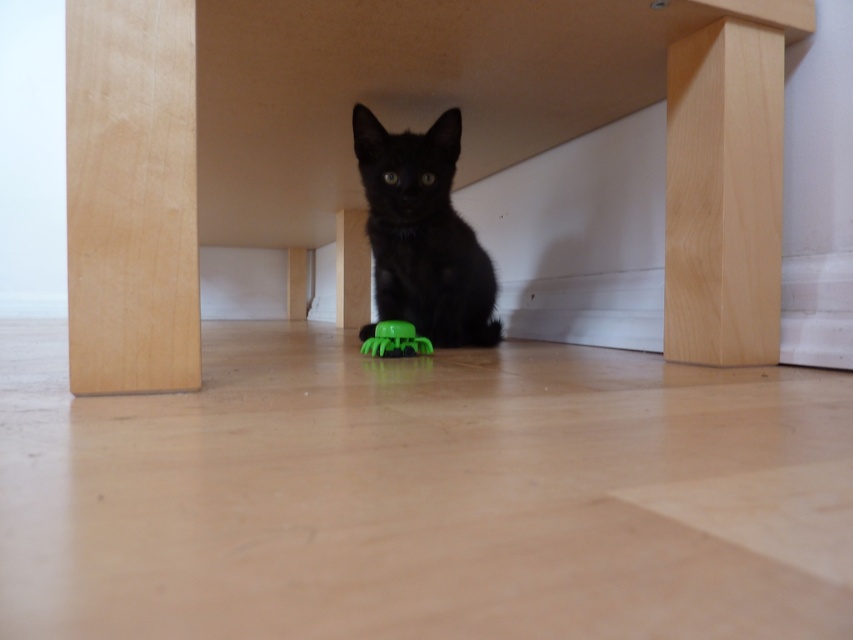
Can you confirm if black matte cat at center is taller than green rubber toy at center?

Yes, black matte cat at center is taller than green rubber toy at center.

Who is more distant from viewer, (413, 220) or (401, 342)?

The point (413, 220) is behind.

Which is in front, point (427, 173) or point (376, 348)?

Positioned in front is point (376, 348).

This screenshot has width=853, height=640. What are the coordinates of `black matte cat at center` in the screenshot? It's located at (422, 234).

Measure the distance between beech wood table at center and camera.

beech wood table at center and camera are 29.06 inches apart.

Does beech wood table at center appear on the left side of green rubber toy at center?

Indeed, beech wood table at center is positioned on the left side of green rubber toy at center.

Between point (757, 74) and point (393, 333), which one is positioned in front?

Point (757, 74) is in front.

The width and height of the screenshot is (853, 640). I want to click on beech wood table at center, so click(401, 124).

Can you confirm if beech wood table at center is taller than black matte cat at center?

Yes.

Between point (106, 54) and point (375, 216), which one is positioned in front?

Point (106, 54) is in front.

The width and height of the screenshot is (853, 640). In order to click on beech wood table at center in this screenshot , I will do `click(401, 124)`.